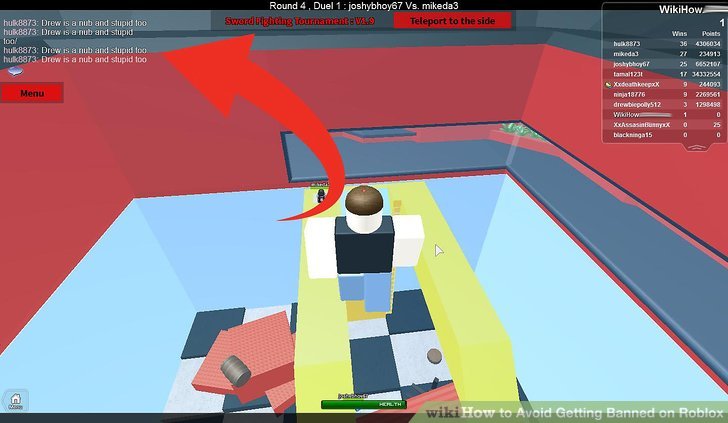
This screenshot has width=728, height=423. I want to click on blue and white tiled floor, so click(x=210, y=334), click(x=201, y=394), click(x=269, y=308), click(x=384, y=377), click(x=413, y=344), click(x=413, y=316), click(x=383, y=319), click(x=245, y=402).